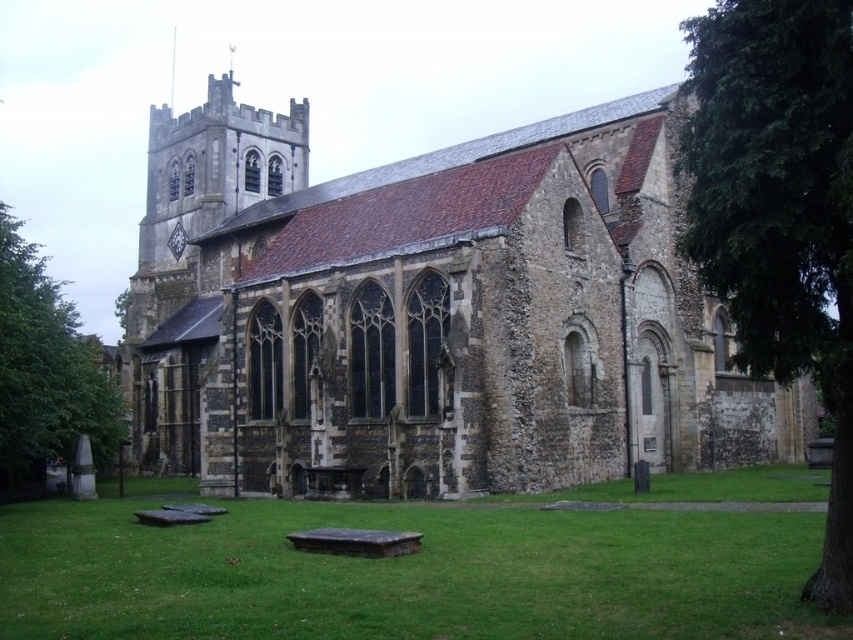
Between brown stone church at center and green leafy tree at lower left, which one appears on the left side from the viewer's perspective?

green leafy tree at lower left

Locate an element on the screen. brown stone church at center is located at coordinates pyautogui.click(x=430, y=310).

Locate an element on the screen. The image size is (853, 640). brown stone church at center is located at coordinates (430, 310).

Which is more to the left, brown stone church at center or green grass at lower center?

brown stone church at center is more to the left.

Can you confirm if brown stone church at center is shorter than green grass at lower center?

No, brown stone church at center is not shorter than green grass at lower center.

Between point (169, 161) and point (436, 572), which one is positioned in front?

Point (436, 572) is in front.

At what (x,y) coordinates should I click in order to perform the action: click on brown stone church at center. Please return your answer as a coordinate pair (x, y). Looking at the image, I should click on (430, 310).

Is brown stone church at center to the left of green leafy tree at right from the viewer's perspective?

Correct, you'll find brown stone church at center to the left of green leafy tree at right.

Is brown stone church at center shorter than green leafy tree at right?

Yes.

In order to click on brown stone church at center in this screenshot , I will do `click(430, 310)`.